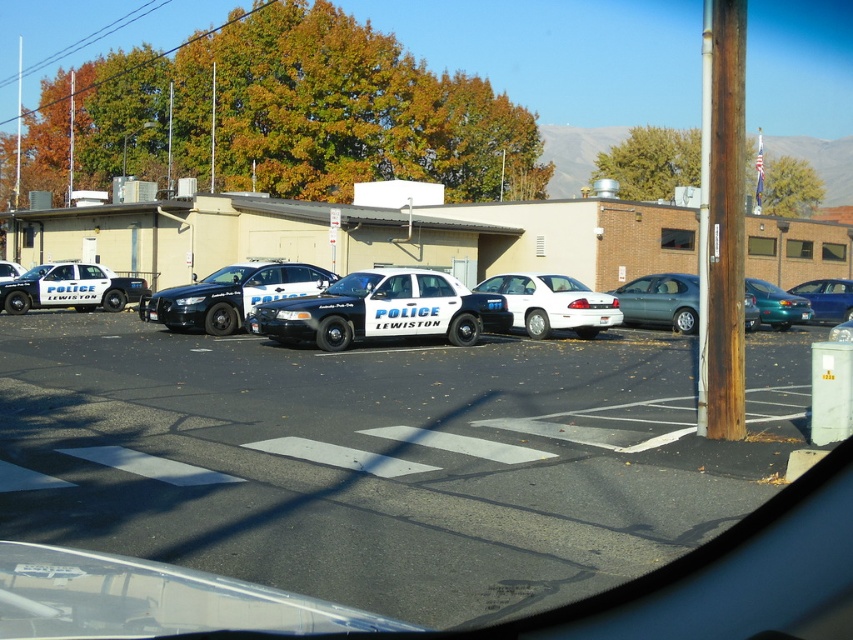
Question: Is matte black police car at left below metallic teal sedan at right?

Choices:
 (A) no
 (B) yes

Answer: (A)

Question: Is white glossy sedan at center to the right of metallic blue sedan at right from the viewer's perspective?

Choices:
 (A) yes
 (B) no

Answer: (B)

Question: Which of the following is the farthest from the observer?

Choices:
 (A) (225, 275)
 (B) (767, 300)

Answer: (B)

Question: Does matte black police car at center come in front of matte black police car at left?

Choices:
 (A) yes
 (B) no

Answer: (A)

Question: Which point is closer to the camera?

Choices:
 (A) (322, 336)
 (B) (808, 310)
 (C) (10, 289)

Answer: (A)

Question: Which point appears closest to the camera in this image?

Choices:
 (A) (322, 396)
 (B) (202, 304)
 (C) (585, 289)
 (D) (618, 296)

Answer: (A)